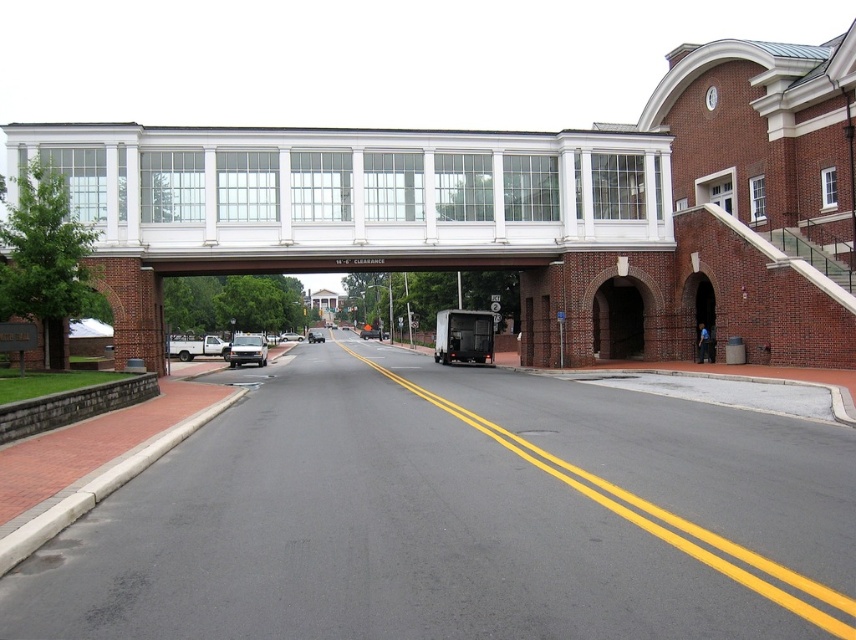
Question: Which point is farther from the camera taking this photo?

Choices:
 (A) (282, 336)
 (B) (318, 333)
 (C) (233, 353)
 (D) (367, 332)

Answer: (D)

Question: Is matte black truck at center above matte white truck at center?

Choices:
 (A) no
 (B) yes

Answer: (B)

Question: Is matte black truck at center to the right of matte white truck at center from the viewer's perspective?

Choices:
 (A) yes
 (B) no

Answer: (A)

Question: Estimate the real-world distances between objects in this image. Which object is closer to the matte white truck at center?

Choices:
 (A) silver metallic sedan at center
 (B) white glass bridge at upper center

Answer: (A)

Question: Which point is farther to the camera?

Choices:
 (A) silver metallic van at center
 (B) matte white truck at center
 (C) matte black truck at center
 (D) white glass bridge at upper center

Answer: (C)

Question: Is matte black truck at center below silver metallic sedan at center?

Choices:
 (A) yes
 (B) no

Answer: (B)